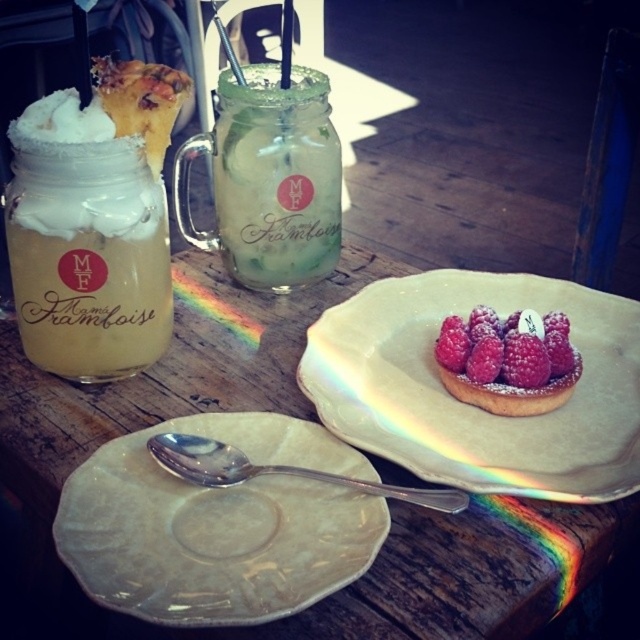
Question: Which of the following is the farthest from the observer?

Choices:
 (A) pink sugared tart at center
 (B) translucent glass jar at upper left
 (C) wooden table at center

Answer: (A)

Question: Which point is farther to the camera?

Choices:
 (A) wooden table at center
 (B) green glass jar at center
 (C) powdered sugar tart at center

Answer: (B)

Question: Is green glass jar at center thinner than pink sugared tart at center?

Choices:
 (A) yes
 (B) no

Answer: (B)

Question: Does powdered sugar tart at center appear under translucent glass jar at upper left?

Choices:
 (A) yes
 (B) no

Answer: (A)

Question: Does white glossy plate at center have a greater width compared to green glass jar at center?

Choices:
 (A) no
 (B) yes

Answer: (B)

Question: Which of the following is the closest to the observer?

Choices:
 (A) wooden table at center
 (B) translucent glass jar at upper left
 (C) white glossy plate at center

Answer: (C)